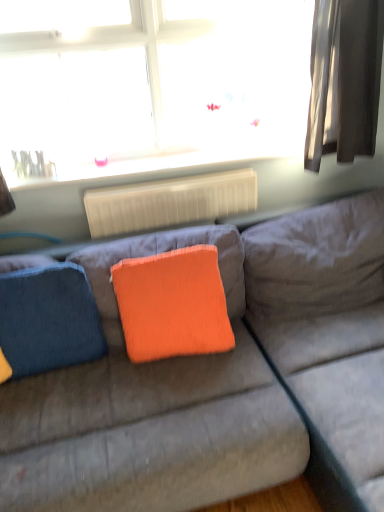
Question: Does denim cushion at left have a lesser height compared to white glossy radiator at upper center?

Choices:
 (A) yes
 (B) no

Answer: (B)

Question: Is denim cushion at left positioned before white glossy radiator at upper center?

Choices:
 (A) yes
 (B) no

Answer: (A)

Question: From the image's perspective, does denim cushion at left appear lower than white glossy radiator at upper center?

Choices:
 (A) yes
 (B) no

Answer: (A)

Question: Considering the relative positions of denim cushion at left and white glossy radiator at upper center in the image provided, is denim cushion at left to the right of white glossy radiator at upper center from the viewer's perspective?

Choices:
 (A) yes
 (B) no

Answer: (B)

Question: Is denim cushion at left wider than white glossy radiator at upper center?

Choices:
 (A) yes
 (B) no

Answer: (B)

Question: Choose the correct answer: Is white plastic radiator at center inside denim cushion at left or outside it?

Choices:
 (A) inside
 (B) outside

Answer: (B)

Question: Visually, is white plastic radiator at center positioned to the left or to the right of denim cushion at left?

Choices:
 (A) left
 (B) right

Answer: (B)

Question: From a real-world perspective, is white plastic radiator at center above or below denim cushion at left?

Choices:
 (A) above
 (B) below

Answer: (A)

Question: Considering the positions of point (139, 221) and point (33, 339), is point (139, 221) closer or farther from the camera than point (33, 339)?

Choices:
 (A) farther
 (B) closer

Answer: (A)

Question: In terms of width, does orange fabric pillow at center look wider or thinner when compared to white plastic radiator at center?

Choices:
 (A) thin
 (B) wide

Answer: (B)

Question: From their relative heights in the image, would you say orange fabric pillow at center is taller or shorter than white plastic radiator at center?

Choices:
 (A) tall
 (B) short

Answer: (A)

Question: Is orange fabric pillow at center to the left or to the right of white plastic radiator at center in the image?

Choices:
 (A) right
 (B) left

Answer: (A)

Question: Considering the positions of point (155, 266) and point (152, 202), is point (155, 266) closer or farther from the camera than point (152, 202)?

Choices:
 (A) farther
 (B) closer

Answer: (B)

Question: Visually, is white glossy radiator at upper center positioned to the left or to the right of transparent glass window at upper center?

Choices:
 (A) left
 (B) right

Answer: (B)

Question: Is white glossy radiator at upper center inside the boundaries of transparent glass window at upper center, or outside?

Choices:
 (A) outside
 (B) inside

Answer: (A)